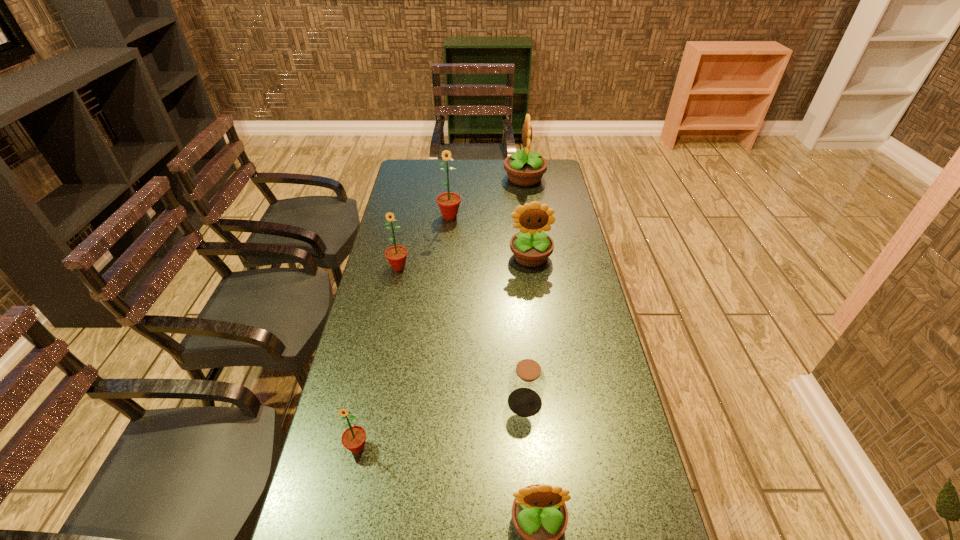
Where is `blank space located 0.270m on the face of the farthest object`? Image resolution: width=960 pixels, height=540 pixels. blank space located 0.270m on the face of the farthest object is located at coordinates (445, 178).

Find the location of a particular element. The image size is (960, 540). free location located on the face of the farthest object is located at coordinates (432, 178).

Locate an element on the screen. The width and height of the screenshot is (960, 540). vacant space positioned on the face of the farthest object is located at coordinates (426, 178).

Find the location of a particular element. The height and width of the screenshot is (540, 960). vacant space located on the face of the fifth nearest sunflower is located at coordinates (444, 281).

The width and height of the screenshot is (960, 540). Identify the location of free space located 0.310m on the face of the second nearest yellow sunflower. (541, 338).

The height and width of the screenshot is (540, 960). Identify the location of vacant space located 0.210m on the face of the second farthest green sunflower. (388, 318).

Locate an element on the screen. The image size is (960, 540). vacant region located 0.170m on the face of the smallest green sunflower is located at coordinates (338, 537).

Where is `vacant region located 0.130m on the left of the third nearest object`? Image resolution: width=960 pixels, height=540 pixels. vacant region located 0.130m on the left of the third nearest object is located at coordinates (459, 402).

Find the location of `object at the far edge`. object at the far edge is located at coordinates (525, 168).

Identify the location of object at the far right corner. (525, 168).